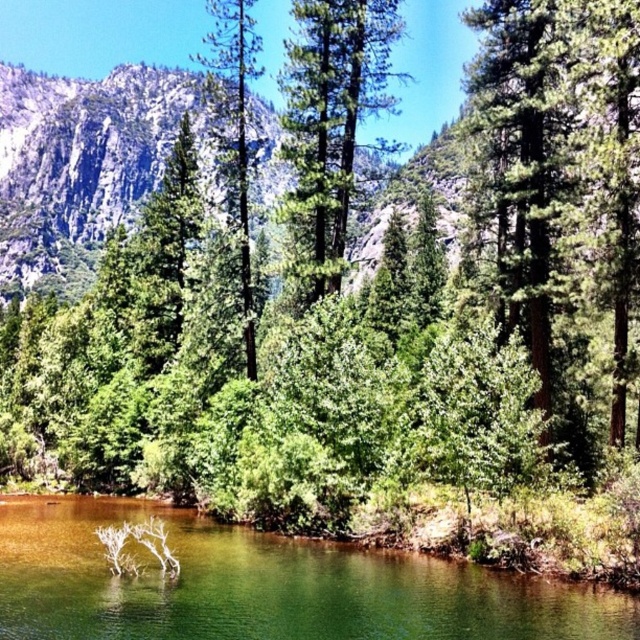
Is green glossy water at center below green matte tree at center?

Correct, green glossy water at center is located below green matte tree at center.

Is green glossy water at center smaller than green matte tree at center?

Yes, green glossy water at center is smaller than green matte tree at center.

You are a GUI agent. You are given a task and a screenshot of the screen. Output one action in this format:
    pyautogui.click(x=<x>, y=<y>)
    Task: Click on the green glossy water at center
    This screenshot has height=640, width=640.
    Given the screenshot: What is the action you would take?
    pyautogui.click(x=268, y=586)

Can you confirm if green textured pine tree at center is wider than green matte tree at center?

In fact, green textured pine tree at center might be narrower than green matte tree at center.

Which is below, green textured pine tree at center or green matte tree at center?

green textured pine tree at center is lower down.

What do you see at coordinates (330, 122) in the screenshot? The image size is (640, 640). I see `green textured pine tree at center` at bounding box center [330, 122].

At what (x,y) coordinates should I click in order to perform the action: click on green textured pine tree at center. Please return your answer as a coordinate pair (x, y). Looking at the image, I should click on [330, 122].

Does green glossy water at center have a lesser height compared to green textured pine tree at center?

Correct, green glossy water at center is not as tall as green textured pine tree at center.

Between point (172, 620) and point (360, 72), which one is positioned in front?

Point (172, 620)

This screenshot has width=640, height=640. I want to click on green glossy water at center, so click(268, 586).